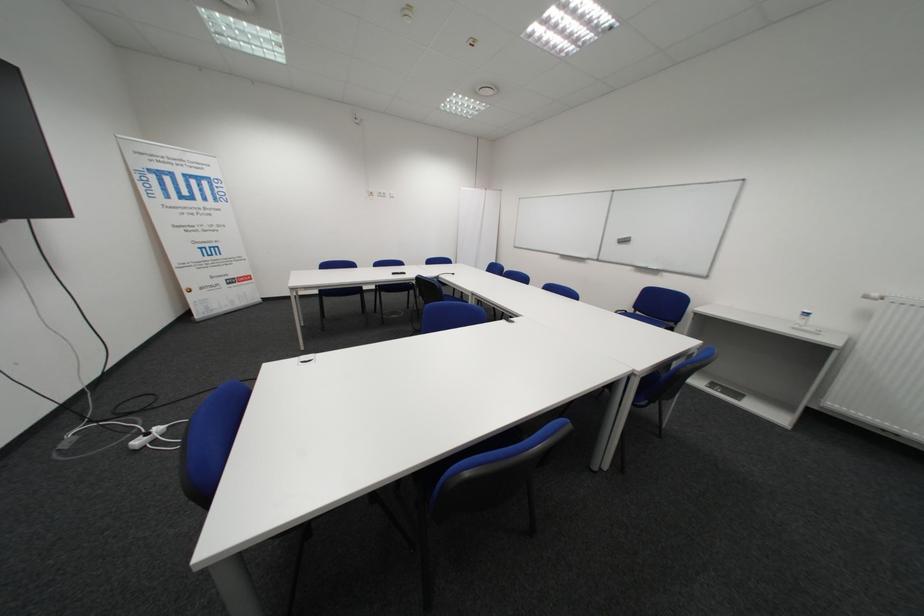
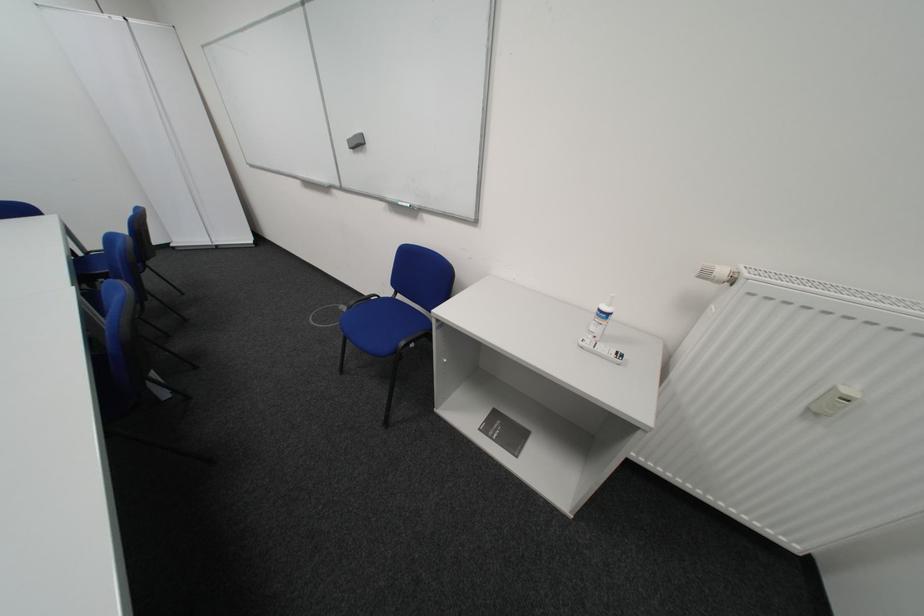
In the second image, find the point that corresponds to [629,241] in the first image.

(361, 143)